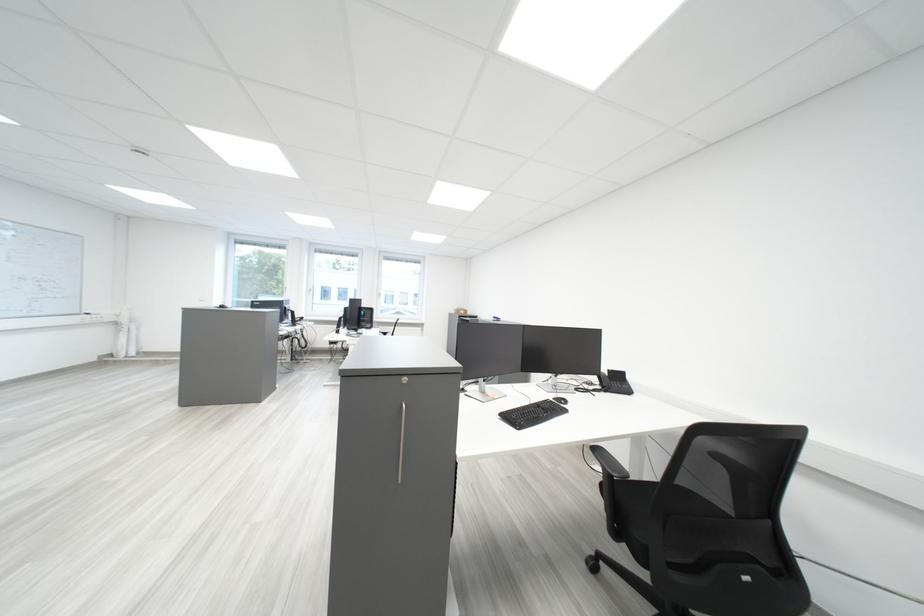
This screenshot has height=616, width=924. I want to click on telephone handset, so click(x=618, y=382).